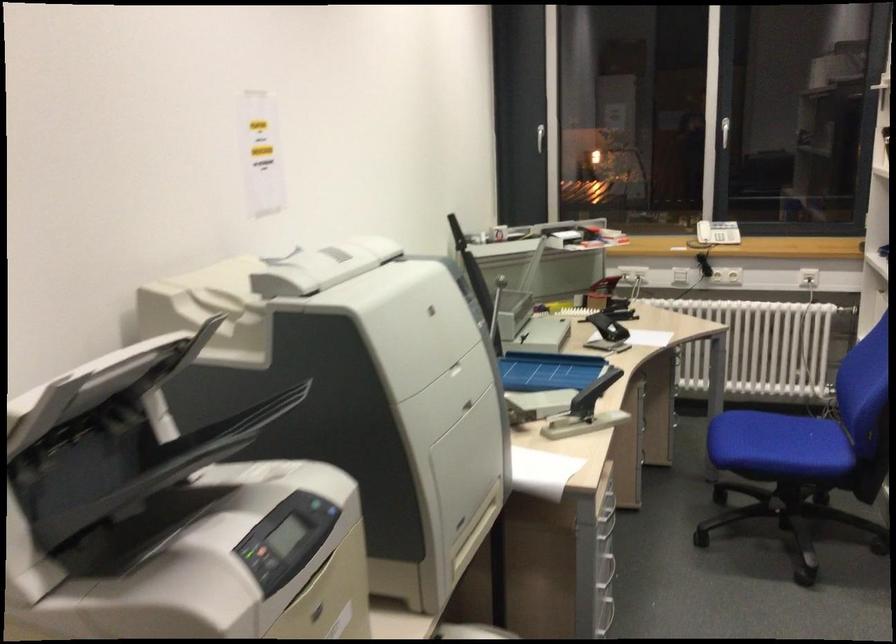
This screenshot has width=896, height=644. Find the location of `blue chair sitting surface`. blue chair sitting surface is located at coordinates (778, 446).